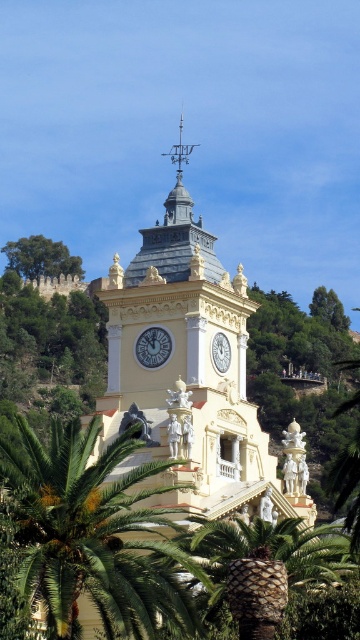
Can you confirm if beige stone clock tower at center is positioned to the left of white glossy clock at upper center?

Indeed, beige stone clock tower at center is positioned on the left side of white glossy clock at upper center.

Is point (222, 468) closer to camera compared to point (213, 342)?

Yes, it is.

Between point (159, 385) and point (225, 336), which one is positioned behind?

Point (225, 336)

Find the location of a particular element. beige stone clock tower at center is located at coordinates (192, 372).

Is beige stone clock tower at center below green leafy palm tree at center?

Incorrect, beige stone clock tower at center is not positioned below green leafy palm tree at center.

Does beige stone clock tower at center appear on the right side of green leafy palm tree at center?

Indeed, beige stone clock tower at center is positioned on the right side of green leafy palm tree at center.

Image resolution: width=360 pixels, height=640 pixels. Describe the element at coordinates (192, 372) in the screenshot. I see `beige stone clock tower at center` at that location.

Where is `beige stone clock tower at center`? The height and width of the screenshot is (640, 360). beige stone clock tower at center is located at coordinates (192, 372).

Which of these two, beige stone clock tower at center or green leafy tree at upper left, stands taller?

beige stone clock tower at center

Is beige stone clock tower at center to the right of green leafy tree at upper left from the viewer's perspective?

Yes, beige stone clock tower at center is to the right of green leafy tree at upper left.

Between point (114, 380) and point (48, 246), which one is positioned in front?

Point (114, 380) is more forward.

This screenshot has height=640, width=360. In order to click on beige stone clock tower at center in this screenshot , I will do `click(192, 372)`.